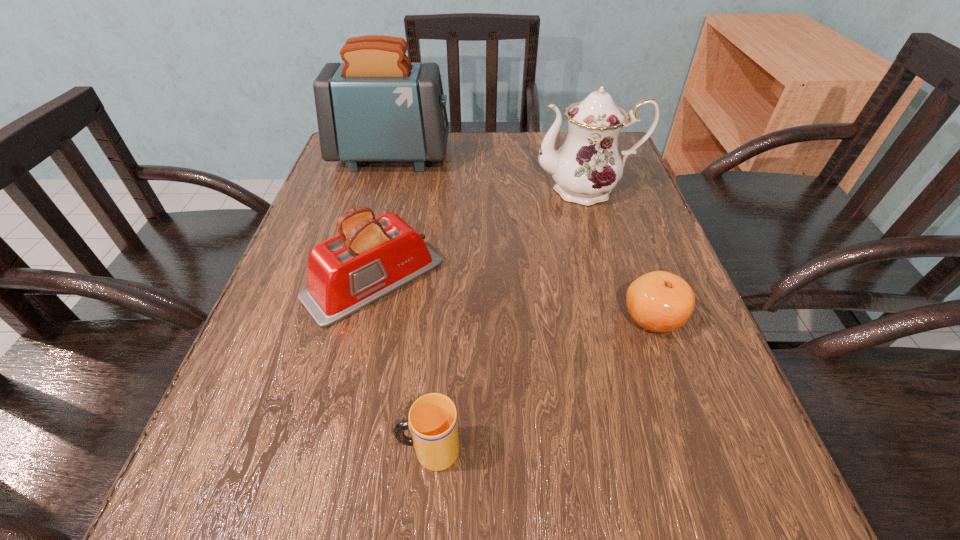
Find the location of a particular element. The height and width of the screenshot is (540, 960). free space located 0.260m on the left of the clementine is located at coordinates (471, 318).

The image size is (960, 540). I want to click on toaster present at the far edge, so click(x=377, y=106).

You are a GUI agent. You are given a task and a screenshot of the screen. Output one action in this format:
    pyautogui.click(x=<x>, y=<y>)
    Task: Click on the chinaware at the far edge
    The width and height of the screenshot is (960, 540).
    Given the screenshot: What is the action you would take?
    pyautogui.click(x=586, y=168)

Locate an element on the screen. The width and height of the screenshot is (960, 540). chinaware located at the right edge is located at coordinates (586, 168).

Identify the location of clementine at the right edge. This screenshot has height=540, width=960. (659, 301).

The width and height of the screenshot is (960, 540). Find the location of `object at the far left corner`. object at the far left corner is located at coordinates (377, 106).

Image resolution: width=960 pixels, height=540 pixels. What are the coordinates of `object that is at the far right corner` in the screenshot? It's located at (586, 168).

Locate an element on the screen. This screenshot has height=540, width=960. blank space at the far edge of the desktop is located at coordinates (468, 140).

Locate an element on the screen. The image size is (960, 540). vacant space at the left edge of the desktop is located at coordinates (320, 205).

This screenshot has height=540, width=960. Identify the location of vacant space at the right edge of the desktop. (671, 364).